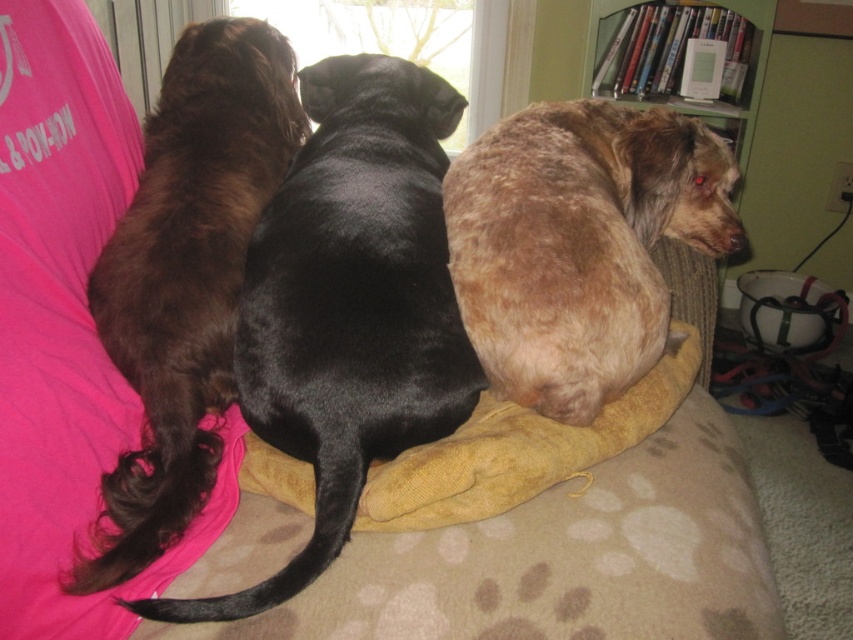
Question: Estimate the real-world distances between objects in this image. Which object is farther from the brown fuzzy dog at left?

Choices:
 (A) yellow fabric at center
 (B) brown fur dog at center

Answer: (A)

Question: Which object is positioned farthest from the fuzzy brown dog at right?

Choices:
 (A) yellow fabric at center
 (B) brown fur dog at center

Answer: (A)

Question: Does brown fur dog at center appear on the left side of brown fuzzy dog at left?

Choices:
 (A) yes
 (B) no

Answer: (B)

Question: Which of the following is the farthest from the observer?

Choices:
 (A) (622, 300)
 (B) (172, 212)
 (C) (376, 332)

Answer: (B)

Question: Can you confirm if brown fur dog at center is smaller than fuzzy brown dog at right?

Choices:
 (A) yes
 (B) no

Answer: (B)

Question: Considering the relative positions of brown fur dog at center and brown fuzzy dog at left in the image provided, where is brown fur dog at center located with respect to brown fuzzy dog at left?

Choices:
 (A) above
 (B) below

Answer: (B)